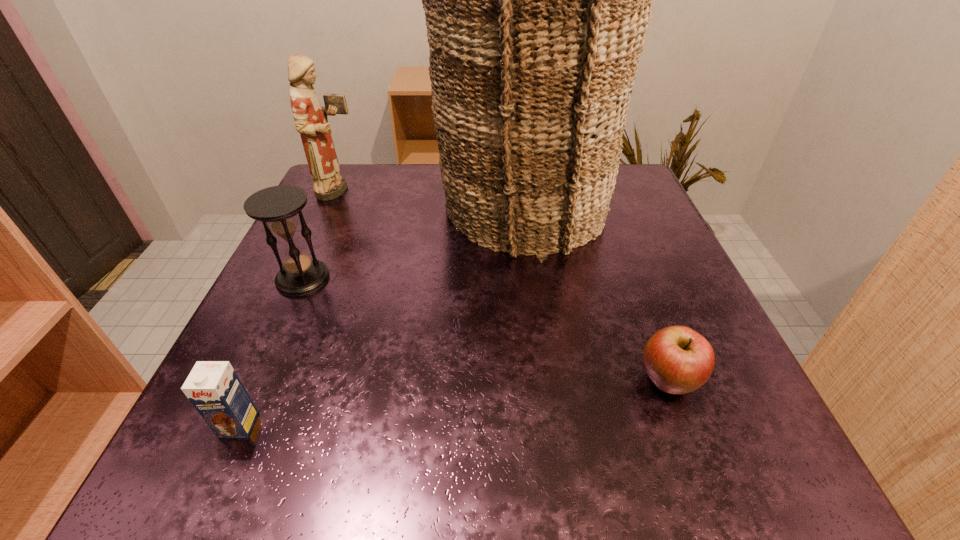
Identify the location of vacant space that satisfies the following two spatial constraints: 1. on the front-facing side of the basket; 2. on the left side of the figurine. (332, 207).

Locate an element on the screen. The image size is (960, 540). free spot that satisfies the following two spatial constraints: 1. on the front-facing side of the tallest object; 2. on the right side of the figurine is located at coordinates (332, 207).

Find the location of `vacant area that satisfies the following two spatial constraints: 1. on the front-facing side of the third shortest object; 2. on the left side of the second tallest object`. vacant area that satisfies the following two spatial constraints: 1. on the front-facing side of the third shortest object; 2. on the left side of the second tallest object is located at coordinates (300, 278).

Locate an element on the screen. free space that satisfies the following two spatial constraints: 1. on the front-facing side of the figurine; 2. on the left side of the basket is located at coordinates (332, 207).

Where is `vacant point that satisfies the following two spatial constraints: 1. on the front-facing side of the second tallest object; 2. on the left side of the fourth farthest object`? The width and height of the screenshot is (960, 540). vacant point that satisfies the following two spatial constraints: 1. on the front-facing side of the second tallest object; 2. on the left side of the fourth farthest object is located at coordinates (253, 382).

Locate an element on the screen. Image resolution: width=960 pixels, height=540 pixels. free spot that satisfies the following two spatial constraints: 1. on the front-facing side of the fourth shortest object; 2. on the left side of the third tallest object is located at coordinates [300, 278].

This screenshot has width=960, height=540. In order to click on free space that satisfies the following two spatial constraints: 1. on the front side of the third tallest object; 2. on the left side of the fourth farthest object in this screenshot , I will do `click(257, 382)`.